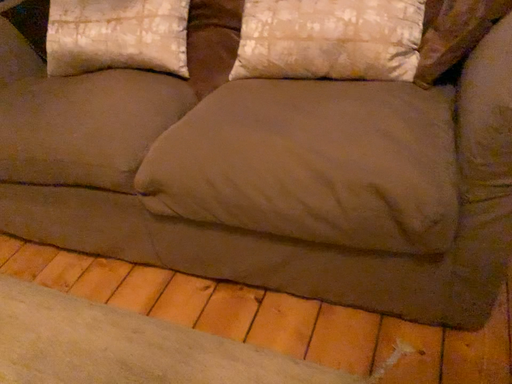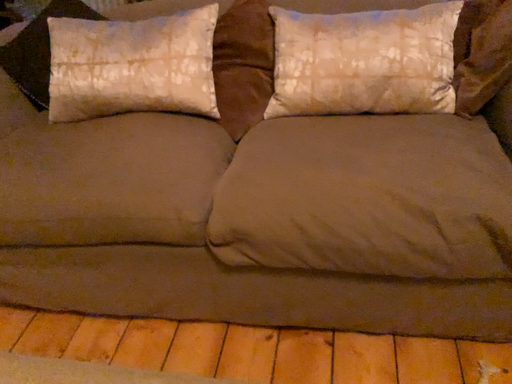
Question: How did the camera likely rotate when shooting the video?

Choices:
 (A) rotated right
 (B) rotated left

Answer: (A)